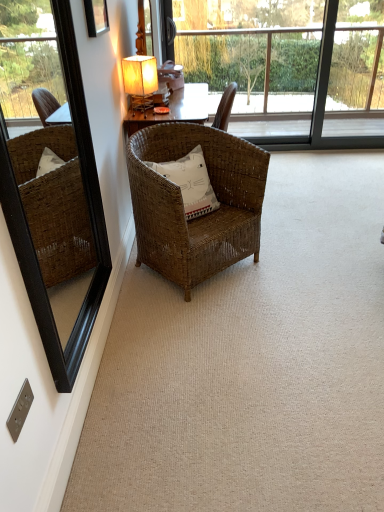
Find the location of `vacant region to the right of woven brown chair at center`. vacant region to the right of woven brown chair at center is located at coordinates pos(298,257).